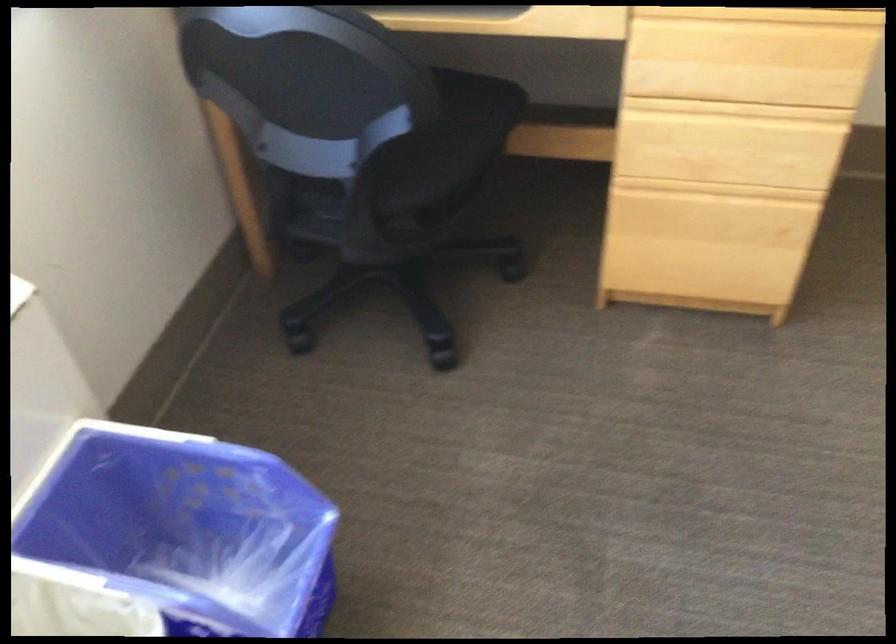
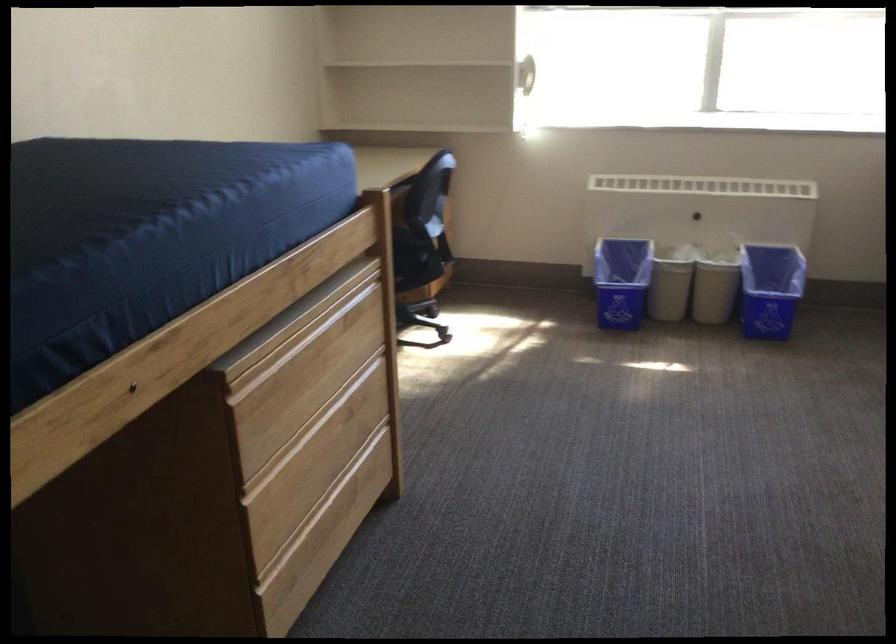
The point at (x=186, y=532) is marked in the first image. Where is the corresponding point in the second image?

(770, 289)